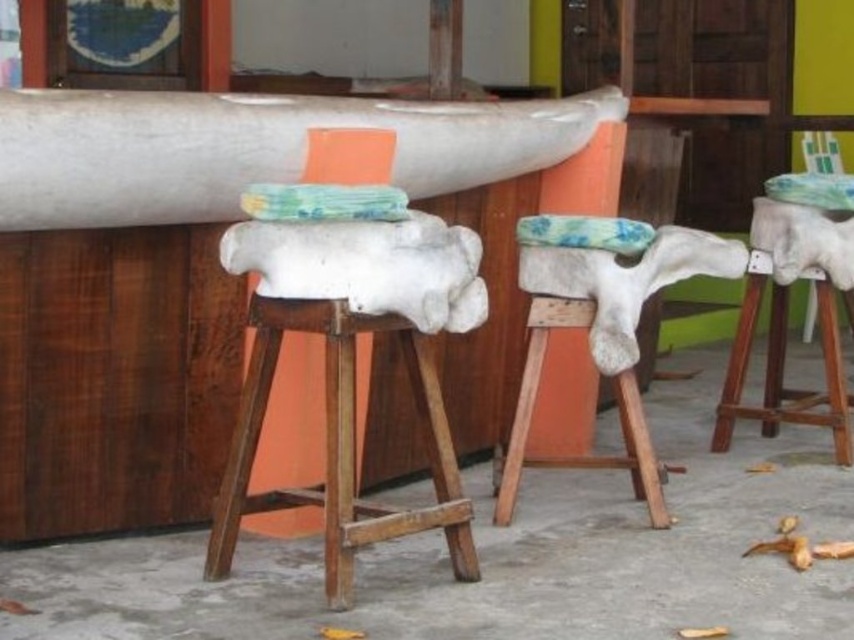
Is white matte boat at center smaller than white leather stool at center?

No, white matte boat at center is not smaller than white leather stool at center.

Does white matte boat at center have a greater height compared to white leather stool at center?

No, white matte boat at center is not taller than white leather stool at center.

Is point (22, 208) less distant than point (823, 397)?

Yes, point (22, 208) is in front of point (823, 397).

Where is `white matte boat at center`? Image resolution: width=854 pixels, height=640 pixels. white matte boat at center is located at coordinates (252, 148).

Does white fur-covered stool at center have a lesser width compared to white leather stool at center?

No.

Is white fur-covered stool at center below white leather stool at center?

Correct, white fur-covered stool at center is located below white leather stool at center.

The image size is (854, 640). Describe the element at coordinates (604, 339) in the screenshot. I see `white fur-covered stool at center` at that location.

At what (x,y) coordinates should I click in order to perform the action: click on white fur-covered stool at center. Please return your answer as a coordinate pair (x, y). Image resolution: width=854 pixels, height=640 pixels. Looking at the image, I should click on (604, 339).

Who is higher up, white stone stool at center or white fur-covered stool at center?

white fur-covered stool at center is higher up.

Does white stone stool at center have a lesser width compared to white fur-covered stool at center?

Correct, white stone stool at center's width is less than white fur-covered stool at center's.

Who is more forward, (234,541) or (612,346)?

Point (234,541) is in front.

Locate an element on the screen. The image size is (854, 640). white stone stool at center is located at coordinates (348, 371).